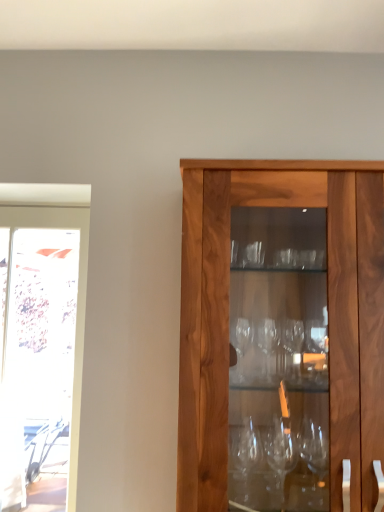
Question: Would you say transparent glass screen door at left is to the left or to the right of walnut wood cabinet at center in the picture?

Choices:
 (A) left
 (B) right

Answer: (A)

Question: Looking at the image, does transparent glass screen door at left seem bigger or smaller compared to walnut wood cabinet at center?

Choices:
 (A) small
 (B) big

Answer: (A)

Question: From the image's perspective, is transparent glass screen door at left located above or below walnut wood cabinet at center?

Choices:
 (A) below
 (B) above

Answer: (A)

Question: Considering the positions of point (253, 172) and point (51, 207), is point (253, 172) closer or farther from the camera than point (51, 207)?

Choices:
 (A) closer
 (B) farther

Answer: (A)

Question: From the image's perspective, is walnut wood cabinet at center located above or below transparent glass screen door at left?

Choices:
 (A) above
 (B) below

Answer: (A)

Question: From a real-world perspective, relative to transparent glass screen door at left, is walnut wood cabinet at center vertically above or below?

Choices:
 (A) below
 (B) above

Answer: (B)

Question: Considering the positions of walnut wood cabinet at center and transparent glass screen door at left in the image, is walnut wood cabinet at center wider or thinner than transparent glass screen door at left?

Choices:
 (A) thin
 (B) wide

Answer: (B)